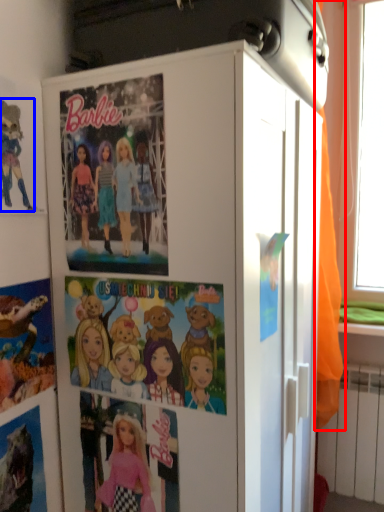
Question: Which point is closer to the camera, curtain (highlighted by a red box) or cartoon (highlighted by a blue box)?

Choices:
 (A) curtain
 (B) cartoon

Answer: (B)